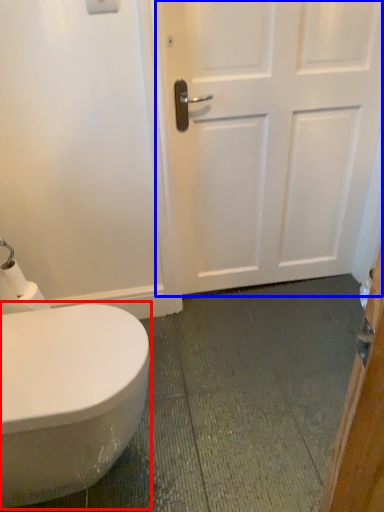
Question: Which object is closer to the camera taking this photo, bidet (highlighted by a red box) or door (highlighted by a blue box)?

Choices:
 (A) bidet
 (B) door

Answer: (A)